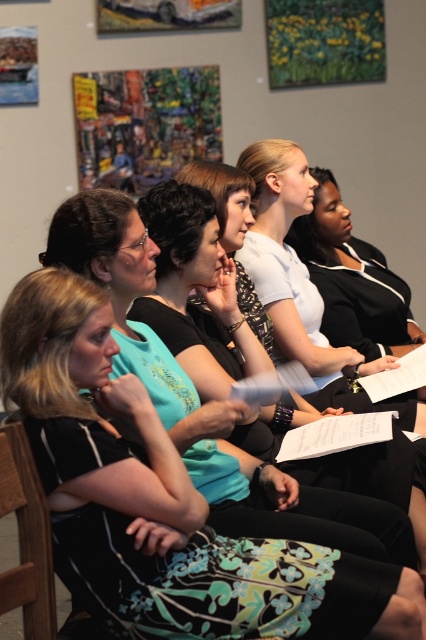
Question: Which point appears farthest from the camera in this image?

Choices:
 (A) (310, 333)
 (B) (118, 490)
 (C) (13, 449)

Answer: (A)

Question: Considering the relative positions of matte black dress at center and wooden at left in the image provided, where is matte black dress at center located with respect to wooden at left?

Choices:
 (A) above
 (B) below

Answer: (A)

Question: Is matte black dress at center to the left of white matte shirt at center from the viewer's perspective?

Choices:
 (A) yes
 (B) no

Answer: (A)

Question: Is matte black dress at center behind wooden at left?

Choices:
 (A) no
 (B) yes

Answer: (A)

Question: Which is farther from the white matte shirt at center?

Choices:
 (A) matte black dress at center
 (B) wooden at left

Answer: (B)

Question: Among these points, which one is nearest to the camera?

Choices:
 (A) (255, 602)
 (B) (40, 524)
 (C) (287, 173)

Answer: (A)